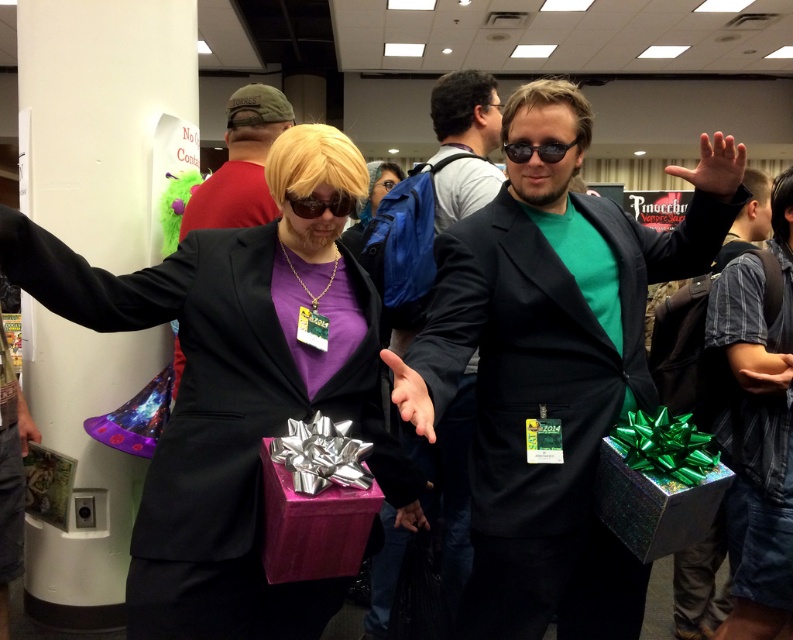
You are standing in the convention hall and want to approach the point marked at coordinates (765, 515). If you move forward 5 feet, will you reach that point?

The point at coordinates (765, 515) is 6.51 feet away from you. Moving forward 5 feet won

You are a photographer at this event. You need to adjust the lighting so that both the matte black suit at center and the matte black hand at center are visible. Since the hand is above the suit, where should you direct the light to ensure both are properly lit?

Since the matte black hand at center is above the matte black suit at center, direct the light downward to illuminate both the hand and the suit evenly.